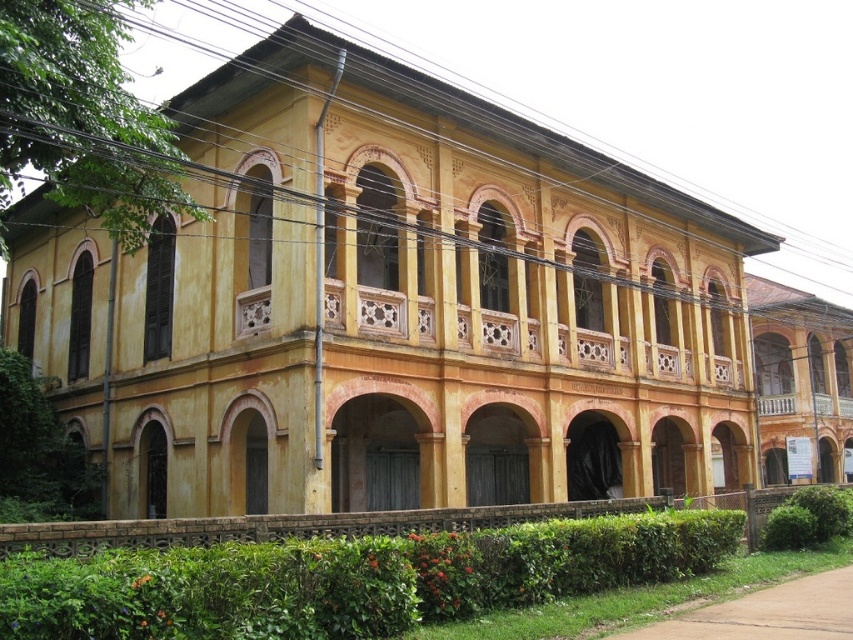
You are standing in front of the two story building and want to walk towards the green leafy hedge at lower center and the yellow painted wood at right. Which object will you reach first?

The green leafy hedge at lower center is closer to the viewer than the yellow painted wood at right, so you will reach the green leafy hedge at lower center first.

You are standing in front of the two story building and want to take a photo. You notice two points marked on the building. The first point is at coordinate point (102,600) and the second is at point (842,348). Which point will appear larger in your photo?

Point (102,600) is closer to the camera than point (842,348), so it will appear larger in the photo.